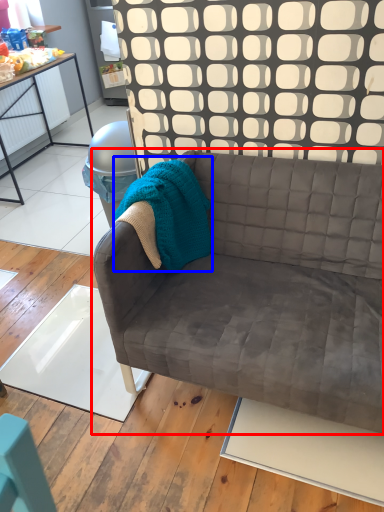
Question: Which point is closer to the camera, studio couch (highlighted by a red box) or blanket (highlighted by a blue box)?

Choices:
 (A) studio couch
 (B) blanket

Answer: (A)